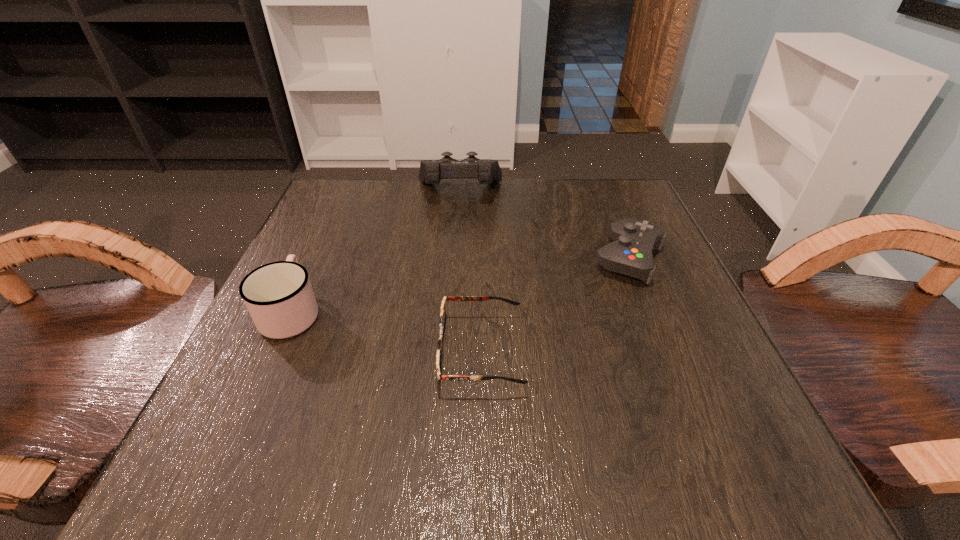
At what (x,y) coordinates should I click in order to perform the action: click on vacant area situated on the front of the shorter control. Please return your answer as a coordinate pair (x, y). The image size is (960, 540). Looking at the image, I should click on 710,459.

Identify the location of vacant space located on the frame of the spectacles. (303, 352).

Locate an element on the screen. This screenshot has height=540, width=960. free space located 0.130m on the frame of the spectacles is located at coordinates coord(355,352).

Locate an element on the screen. vacant region located 0.290m on the frame of the spectacles is located at coordinates (252, 352).

Find the location of a particular element. Image resolution: width=960 pixels, height=540 pixels. object that is at the left edge is located at coordinates (279, 297).

Locate an element on the screen. This screenshot has height=540, width=960. object that is at the right edge is located at coordinates (630, 254).

Locate an element on the screen. This screenshot has height=540, width=960. object that is at the far right corner is located at coordinates click(x=630, y=254).

Where is `vacant space at the far edge of the desktop`? Image resolution: width=960 pixels, height=540 pixels. vacant space at the far edge of the desktop is located at coordinates (526, 179).

You are a GUI agent. You are given a task and a screenshot of the screen. Output one action in this format:
    pyautogui.click(x=<x>, y=<y>)
    Task: Click on the vacant region at the near edge of the desktop
    
    Given the screenshot: What is the action you would take?
    pyautogui.click(x=579, y=440)

The image size is (960, 540). In the image, there is a desktop. Find the location of `vacant space at the left edge`. vacant space at the left edge is located at coordinates (317, 315).